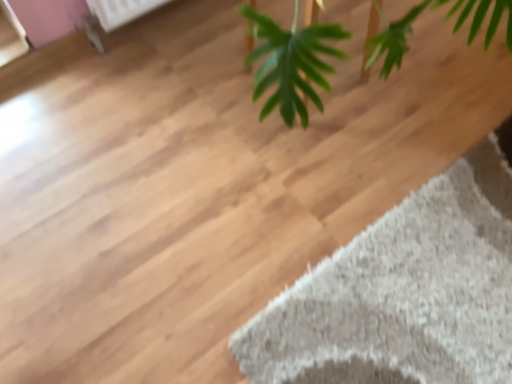
What are the coordinates of `vacant space situated on the left part of white shaggy rug at lower right` in the screenshot? It's located at (224, 263).